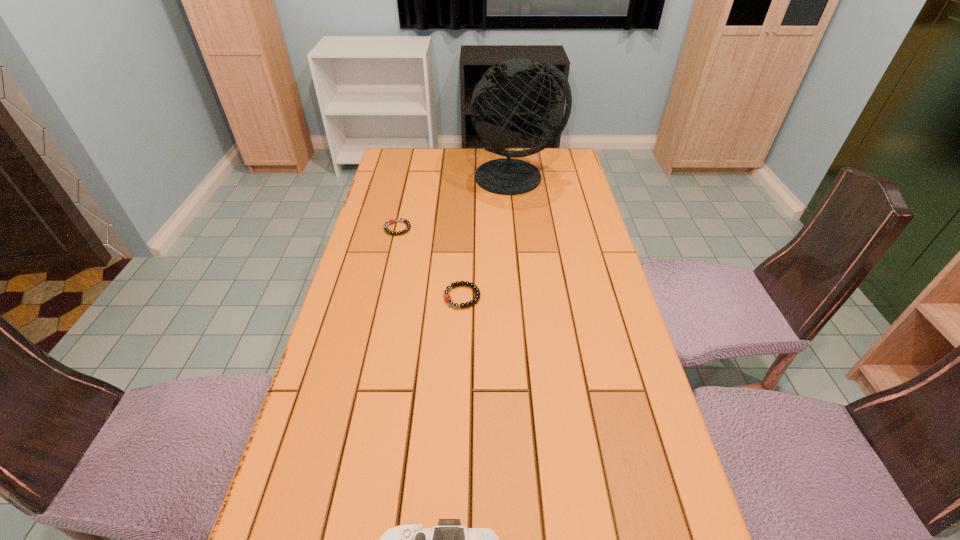
Locate an element on the screen. The height and width of the screenshot is (540, 960). free area in between the third farthest object and the shorter bracelet is located at coordinates (430, 262).

Identify the location of object that stands as the closest to the right bracelet. The width and height of the screenshot is (960, 540). (391, 221).

You are a GUI agent. You are given a task and a screenshot of the screen. Output one action in this format:
    pyautogui.click(x=<x>, y=<y>)
    Task: Click on the object that stands as the closest to the nearest object
    This screenshot has width=960, height=540.
    Given the screenshot: What is the action you would take?
    pyautogui.click(x=447, y=297)

Find the location of `vacant space that satisfies the following two spatial constraints: 1. on the front side of the farther bracelet; 2. on the right side of the second nearest object`. vacant space that satisfies the following two spatial constraints: 1. on the front side of the farther bracelet; 2. on the right side of the second nearest object is located at coordinates (382, 296).

Where is `vacant space that satisfies the following two spatial constraints: 1. on the front side of the left bracelet; 2. on the left side of the right bracelet`? vacant space that satisfies the following two spatial constraints: 1. on the front side of the left bracelet; 2. on the left side of the right bracelet is located at coordinates (382, 296).